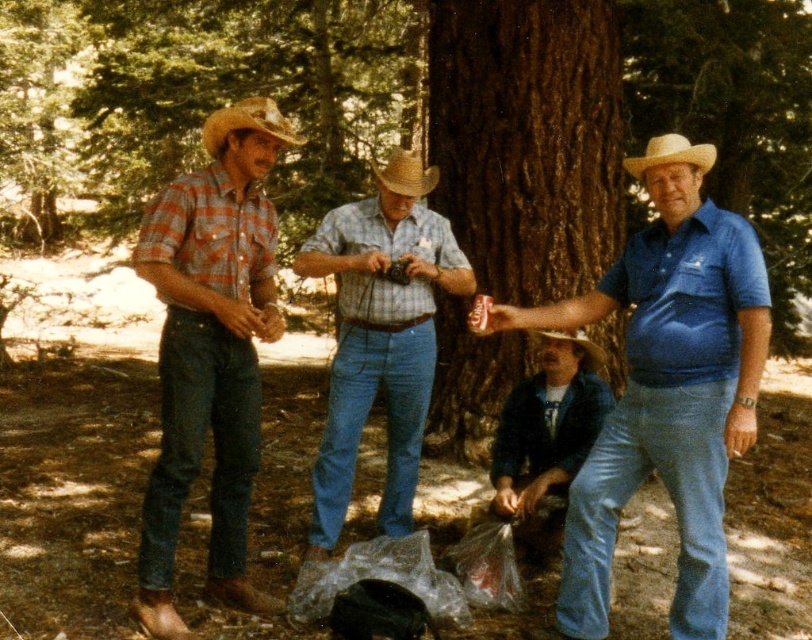
Question: Can you confirm if plaid shirt at center is wider than light brown straw cowboy hat at right?

Choices:
 (A) yes
 (B) no

Answer: (A)

Question: Which point is closer to the camera taking this photo?

Choices:
 (A) (335, 352)
 (B) (542, 192)

Answer: (A)

Question: Which of the following is the closest to the observer?

Choices:
 (A) blue denim jeans at lower center
 (B) brown rough bark tree at center
 (C) strawmaterial/texturecowboy hat at center

Answer: (C)

Question: Which point is farther to the camera?

Choices:
 (A) (694, 163)
 (B) (340, 467)
 (C) (160, 202)
 (D) (594, 152)

Answer: (D)

Question: Does denim jeans at center appear under blue cotton shirt at center?

Choices:
 (A) no
 (B) yes

Answer: (B)

Question: Can you confirm if plaid cotton shirt at left is thinner than plaid shirt at center?

Choices:
 (A) yes
 (B) no

Answer: (A)